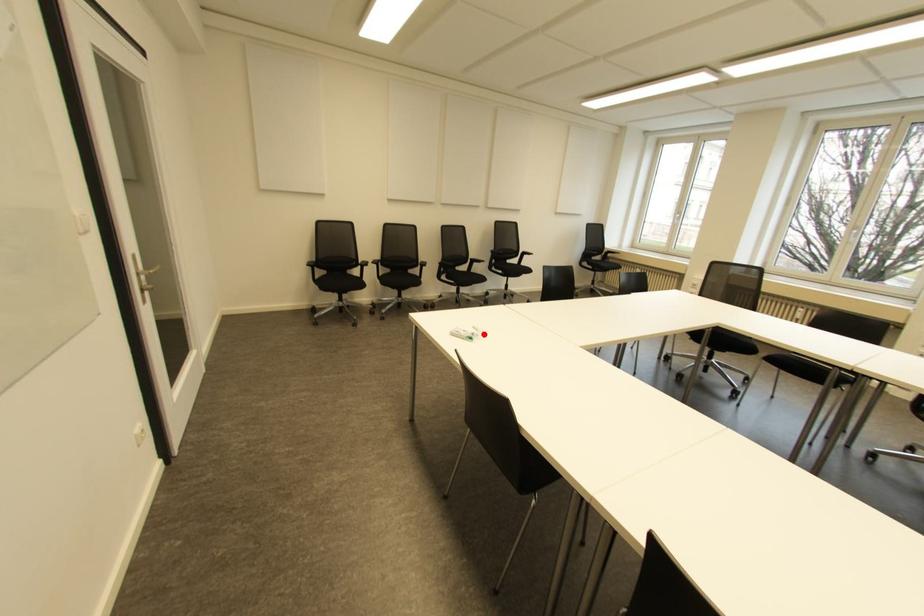
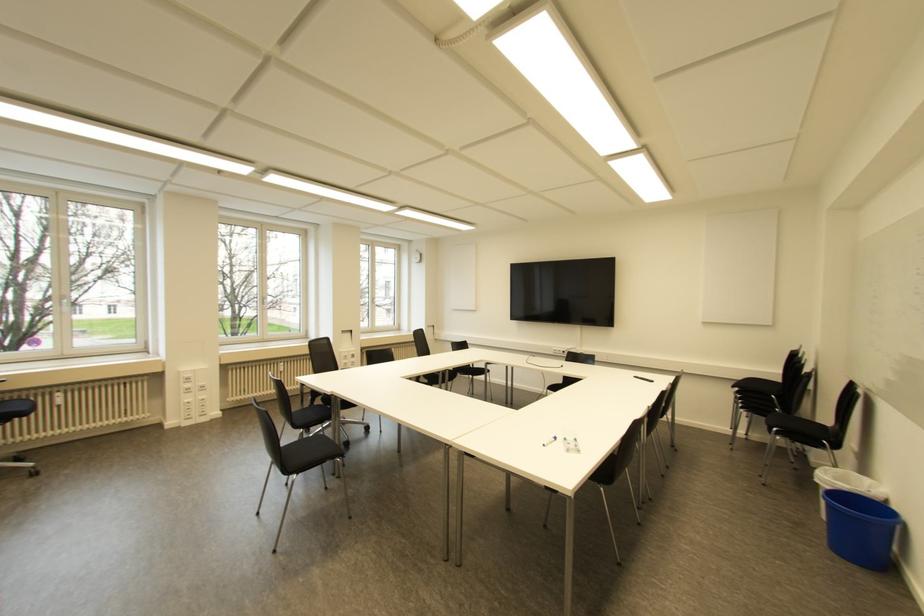
Question: I am providing you with two images of the same scene from different viewpoints. In image1, a red point is highlighted. Considering the same 3D point in image2, which of the following is correct?

Choices:
 (A) It is closer
 (B) It is farther

Answer: (A)